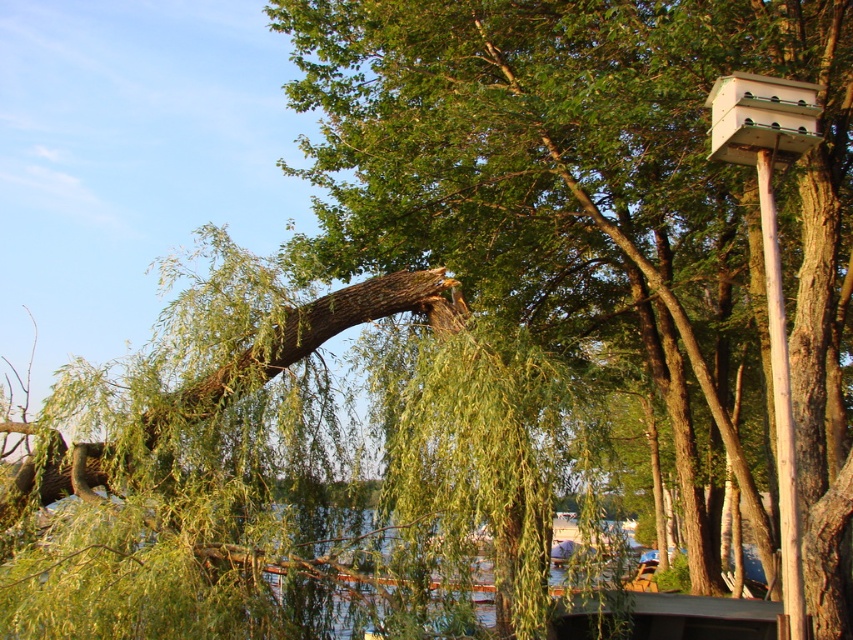
You are a small frog that can jump 50 centimeters. You are currently on the green leafy willow at center and want to reach the green leafy water at lower center. Can you make the jump in one try?

The distance between the green leafy willow at center and the green leafy water at lower center is 47.59 centimeters. Since the frog can jump 50 centimeters, it can make the jump in one try.

You are standing at the center of the image and want to walk to the green leafy water at lower center. According to the coordinates provided, in which direction should you move?

The green leafy water at lower center is located at point 0.922 on the x axis and 0.213 on the y axis. Since you are at the center, you should move towards the lower right direction to reach it.

Looking at this image, you are standing at the edge of the lake and see the wooden post with the birdhouse on the right side of the image. There is a specific point marked at coordinates point (291, 468). Can you tell me what object this point is located on?

The point (291, 468) is located on the green leafy willow at center.